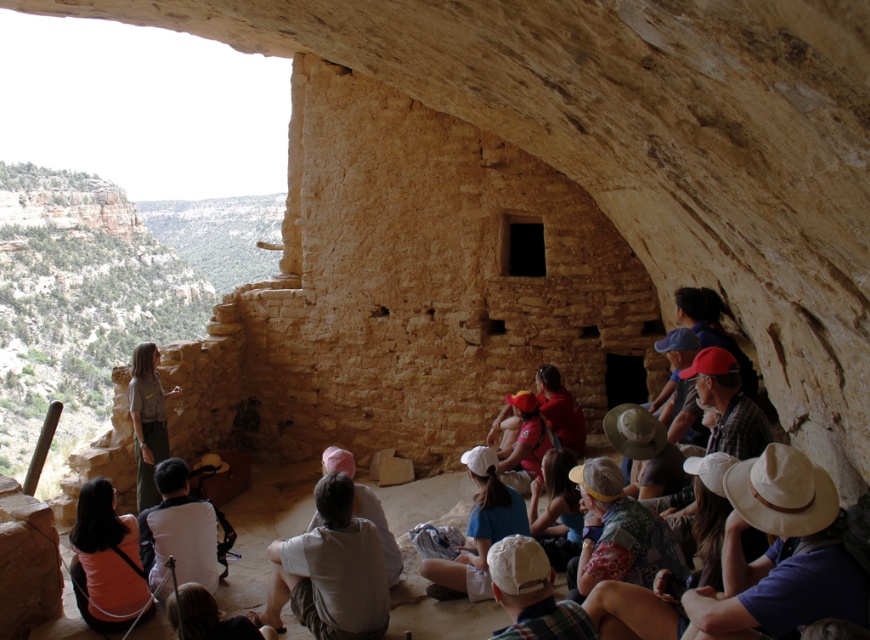
Does white woven hat at lower right have a greater width compared to printed fabric hat at lower center?

Yes, white woven hat at lower right is wider than printed fabric hat at lower center.

I want to click on white woven hat at lower right, so click(x=780, y=552).

Based on the photo, is white cotton hat at center to the left of pink fabric hat at center from the viewer's perspective?

Incorrect, white cotton hat at center is not on the left side of pink fabric hat at center.

Who is positioned more to the right, white cotton hat at center or pink fabric hat at center?

white cotton hat at center is more to the right.

Is point (500, 522) positioned after point (378, 509)?

That is False.

Identify the location of white cotton hat at center. This screenshot has width=870, height=640. (480, 529).

Is the position of white woven hat at lower right less distant than that of white cotton shirt at lower center?

Yes, white woven hat at lower right is in front of white cotton shirt at lower center.

Does point (760, 502) come in front of point (164, 518)?

Yes, point (760, 502) is in front of point (164, 518).

At what (x,y) coordinates should I click in order to perform the action: click on white woven hat at lower right. Please return your answer as a coordinate pair (x, y). Looking at the image, I should click on (780, 552).